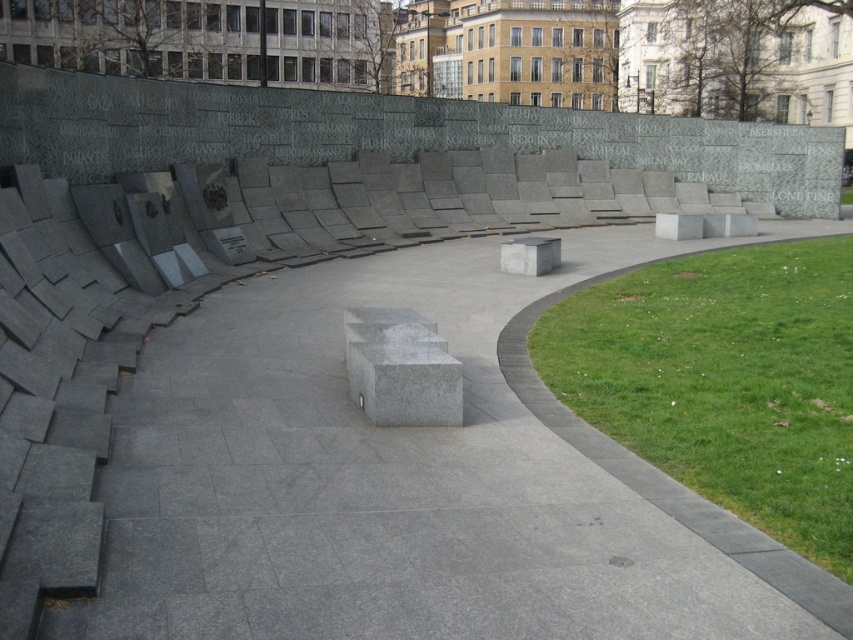
You are standing on the gray concrete pavement at center and want to walk towards the green grass at lower right. Which direction should you move to reach it?

To reach the green grass at lower right from the gray concrete pavement at center, you should move upwards since the gray concrete pavement at center is located below the green grass at lower right.